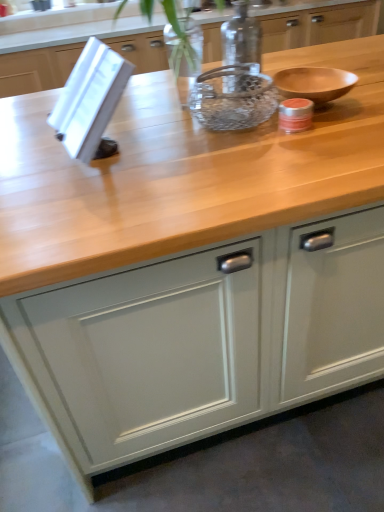
Question: Considering the positions of clear glass jar at center and matte gray cabinet at center in the image, is clear glass jar at center wider or thinner than matte gray cabinet at center?

Choices:
 (A) thin
 (B) wide

Answer: (A)

Question: Looking at the image, does clear glass jar at center seem bigger or smaller compared to matte gray cabinet at center?

Choices:
 (A) small
 (B) big

Answer: (A)

Question: Considering the real-world distances, which object is farthest from the matte gray cabinet at center?

Choices:
 (A) clear glass bowl at center
 (B) clear glass jar at center

Answer: (B)

Question: Which is farther from the clear glass bowl at center?

Choices:
 (A) clear glass jar at center
 (B) matte gray cabinet at center

Answer: (B)